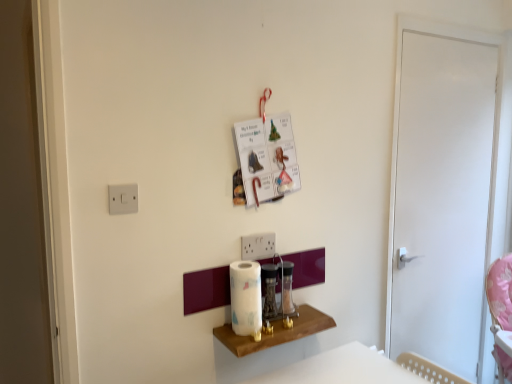
What are the coordinates of `free space above wooden shelf at center (from a real-world perspective)` in the screenshot? It's located at (278, 323).